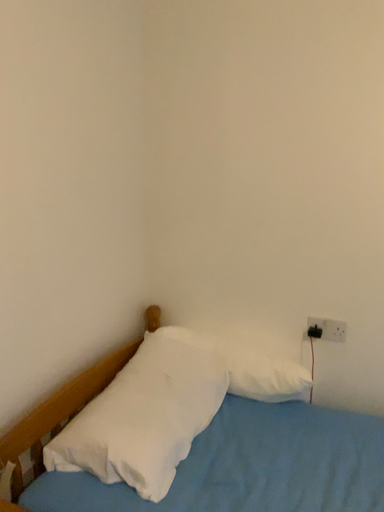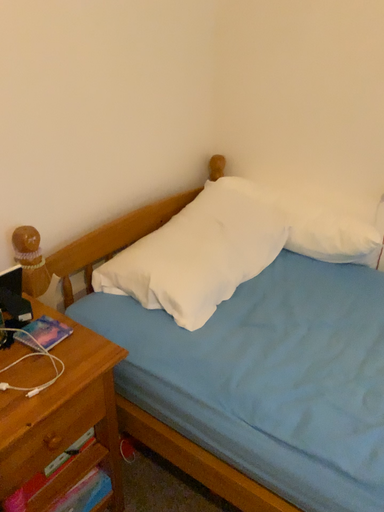
Question: Which way did the camera rotate in the video?

Choices:
 (A) rotated downward
 (B) rotated upward

Answer: (A)